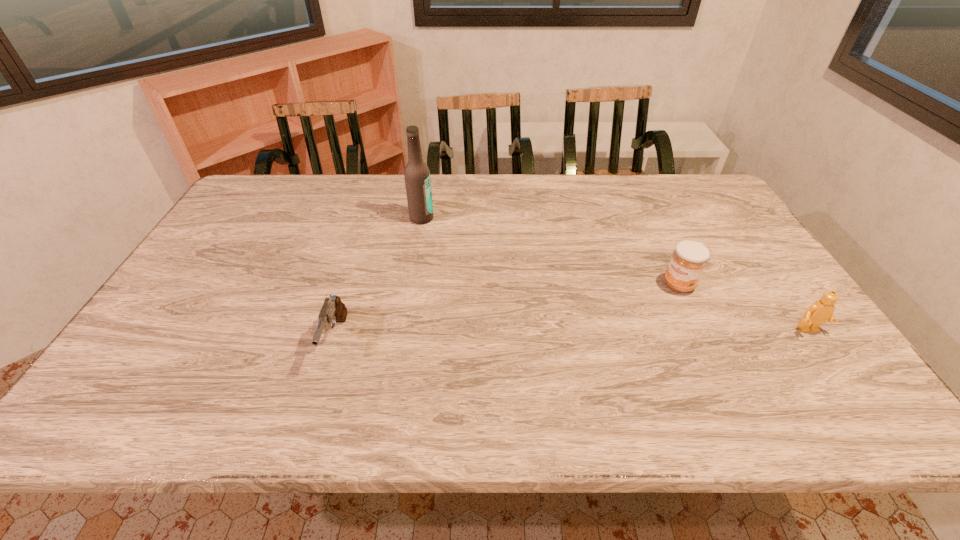
Locate an element on the screen. the leftmost object is located at coordinates (333, 310).

This screenshot has height=540, width=960. What are the coordinates of `Lego` in the screenshot? It's located at (820, 311).

Where is `jam`? jam is located at coordinates (688, 261).

Image resolution: width=960 pixels, height=540 pixels. Identify the location of the second object from right to left. (688, 261).

Where is `the second object from left to right`? This screenshot has height=540, width=960. the second object from left to right is located at coordinates (416, 173).

At what (x,y) coordinates should I click in order to perform the action: click on the tallest object. Please return your answer as a coordinate pair (x, y). The width and height of the screenshot is (960, 540). Looking at the image, I should click on (416, 173).

Locate an element on the screen. This screenshot has height=540, width=960. free space located 0.120m on the face of the rightmost object is located at coordinates (843, 379).

The height and width of the screenshot is (540, 960). Find the location of `vacant space located 0.330m on the front label of the jam`. vacant space located 0.330m on the front label of the jam is located at coordinates (594, 360).

This screenshot has width=960, height=540. In order to click on vacant area located 0.060m on the front label of the jam in this screenshot , I will do `click(658, 303)`.

Find the location of a particular element. The width and height of the screenshot is (960, 540). vacant area situated on the front label of the jam is located at coordinates (622, 335).